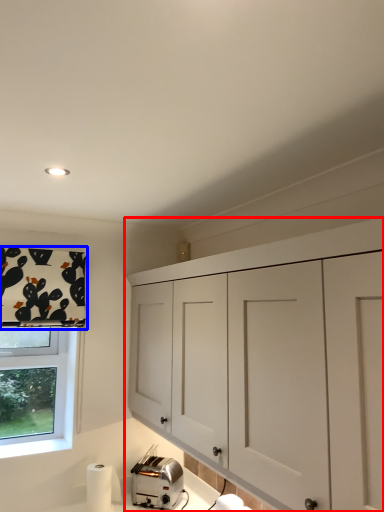
Question: Which of the following is the closest to the observer, cabinetry (highlighted by a red box) or curtain (highlighted by a blue box)?

Choices:
 (A) cabinetry
 (B) curtain

Answer: (A)